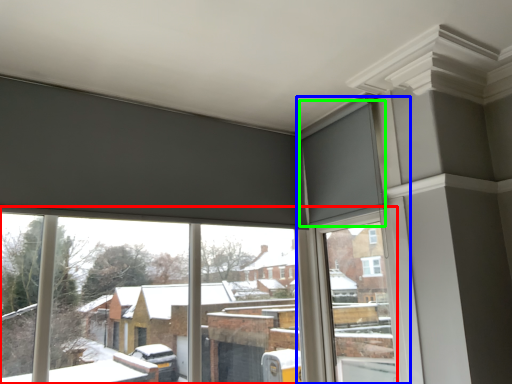
Question: Which object is the closest to the window (highlighted by a red box)? Choose among these: window frame (highlighted by a blue box) or curtain (highlighted by a green box).

Choices:
 (A) window frame
 (B) curtain

Answer: (A)